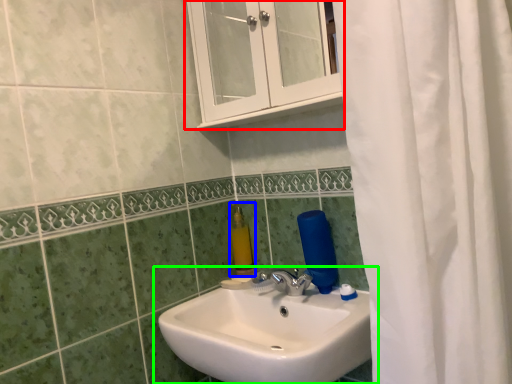
Question: Considering the real-world distances, which object is farthest from medicine cabinet (highlighted by a red box)? soap dispenser (highlighted by a blue box) or sink (highlighted by a green box)?

Choices:
 (A) soap dispenser
 (B) sink

Answer: (B)